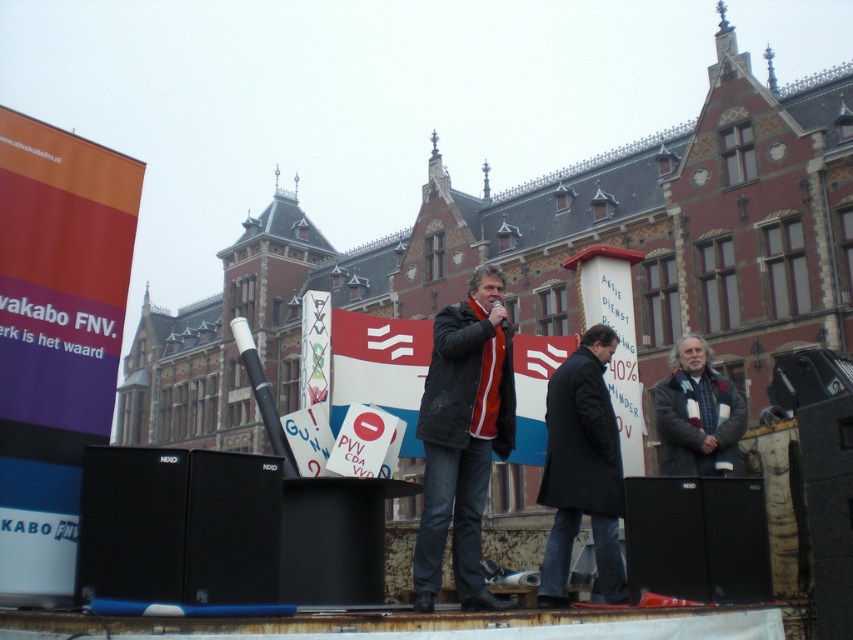
Which is in front, point (193, 522) or point (720, 568)?

Point (193, 522)

Consider the image. Which is below, black matte speaker at center or black matte speaker at lower right?

Positioned lower is black matte speaker at lower right.

Is point (234, 481) positioned before point (753, 568)?

Yes, it is in front of point (753, 568).

Image resolution: width=853 pixels, height=640 pixels. I want to click on black matte speaker at center, so click(231, 529).

You are a GUI agent. You are given a task and a screenshot of the screen. Output one action in this format:
    pyautogui.click(x=<x>, y=<y>)
    Task: Click on the dark gray jacket at center
    This screenshot has width=853, height=640.
    Given the screenshot: What is the action you would take?
    pyautogui.click(x=463, y=436)

Measure the distance from dark gray jacket at center to gray woolen coat at right.

A distance of 9.86 meters exists between dark gray jacket at center and gray woolen coat at right.

Describe the element at coordinates (463, 436) in the screenshot. I see `dark gray jacket at center` at that location.

Where is `dark gray jacket at center`? The height and width of the screenshot is (640, 853). dark gray jacket at center is located at coordinates (463, 436).

Looking at this image, does matte black speaker at center have a larger size compared to gray woolen coat at right?

No.

Between matte black speaker at center and gray woolen coat at right, which one is positioned higher?

gray woolen coat at right is above.

Where is `matte black speaker at center`? matte black speaker at center is located at coordinates coord(665,538).

Where is `matte black speaker at center`? matte black speaker at center is located at coordinates (665, 538).